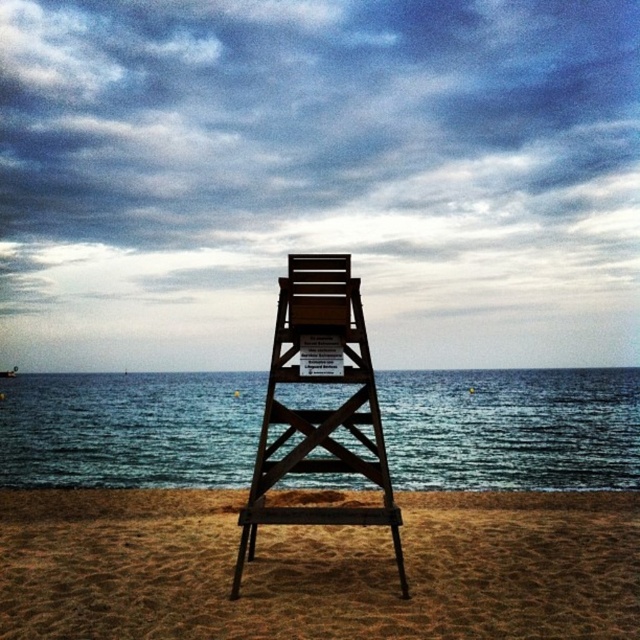
Question: Can you confirm if brown sandy beach at center is positioned to the right of wooden lifeguard chair at center?

Choices:
 (A) no
 (B) yes

Answer: (A)

Question: Estimate the real-world distances between objects in this image. Which object is farther from the wooden lifeguard chair at center?

Choices:
 (A) brown sandy beach at center
 (B) blue water at center

Answer: (B)

Question: Which of the following is the farthest from the observer?

Choices:
 (A) blue water at center
 (B) brown sandy beach at center
 (C) wooden lifeguard chair at center

Answer: (A)

Question: Among these points, which one is nearest to the camera?

Choices:
 (A) (320, 428)
 (B) (124, 426)

Answer: (A)

Question: Is brown sandy beach at center below blue water at center?

Choices:
 (A) yes
 (B) no

Answer: (B)

Question: Observing the image, what is the correct spatial positioning of blue water at center in reference to wooden lifeguard chair at center?

Choices:
 (A) above
 (B) below

Answer: (B)